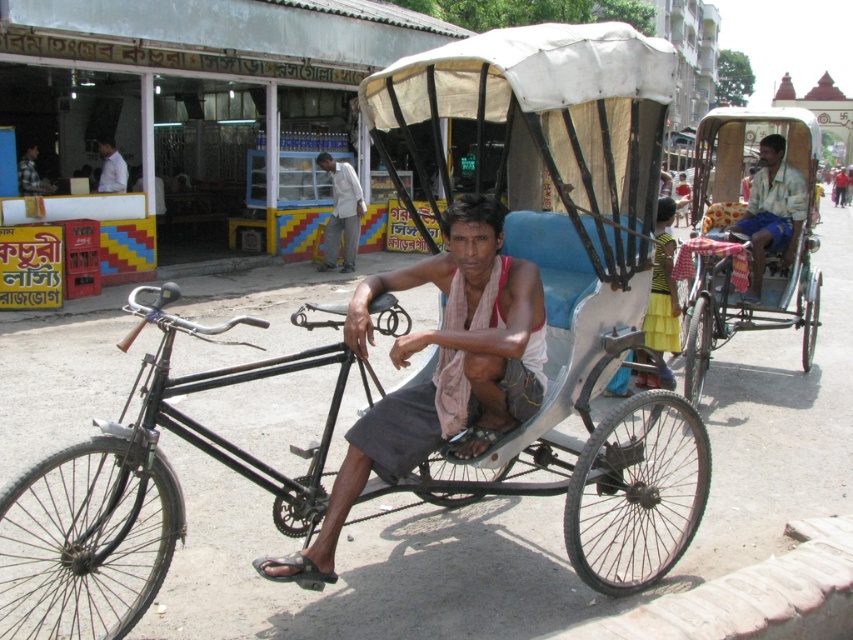
Question: Does matte pink scarf at center lie in front of white fabric cart at right?

Choices:
 (A) yes
 (B) no

Answer: (A)

Question: Is matte pink scarf at center smaller than white fabric cart at right?

Choices:
 (A) no
 (B) yes

Answer: (A)

Question: Does white fabric rickshaw at center appear on the right side of light gray fabric shirt at center?

Choices:
 (A) no
 (B) yes

Answer: (B)

Question: Which of the following is the closest to the observer?

Choices:
 (A) (412, 266)
 (B) (41, 628)
 (C) (331, 227)
 (D) (749, 212)

Answer: (B)

Question: Which point is farther to the camera?

Choices:
 (A) (119, 492)
 (B) (409, 470)
 (C) (708, 291)
 (D) (759, 211)

Answer: (D)

Question: Which point is farther to the camera?

Choices:
 (A) yellow fabric coach at center
 (B) light gray fabric shirt at center
 (C) white fabric rickshaw at center
 (D) black matte bicycle at center

Answer: (B)